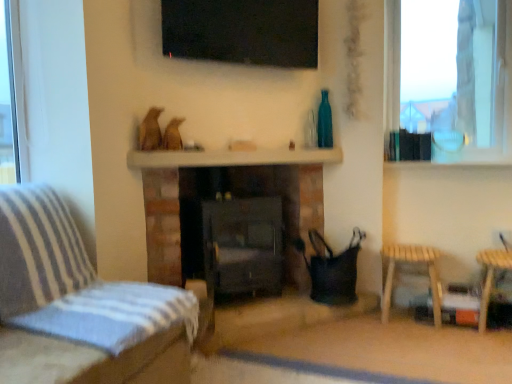
Question: Is point [x=166, y=48] positioned closer to the camera than point [x=505, y=253]?

Choices:
 (A) closer
 (B) farther

Answer: (A)

Question: In terms of size, does black glass tv at upper center appear bigger or smaller than wooden stool at lower right?

Choices:
 (A) small
 (B) big

Answer: (B)

Question: Estimate the real-world distances between objects in this image. Which object is closer to the striped fabric couch at left?

Choices:
 (A) black glass tv at upper center
 (B) light wood stool at lower right
 (C) transparent glass window at upper right
 (D) matte black stove at center
 (E) teal glass bottle at upper right

Answer: (D)

Question: Considering the real-world distances, which object is farthest from the transparent glass window at upper right?

Choices:
 (A) striped fabric couch at left
 (B) black glass tv at upper center
 (C) wooden stool at lower right
 (D) teal glass bottle at upper right
 (E) light wood stool at lower right

Answer: (A)